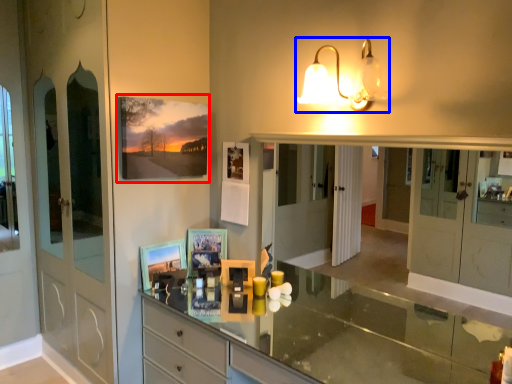
Question: Which object appears closest to the camera in this image, picture frame (highlighted by a red box) or lamp (highlighted by a blue box)?

Choices:
 (A) picture frame
 (B) lamp

Answer: (B)